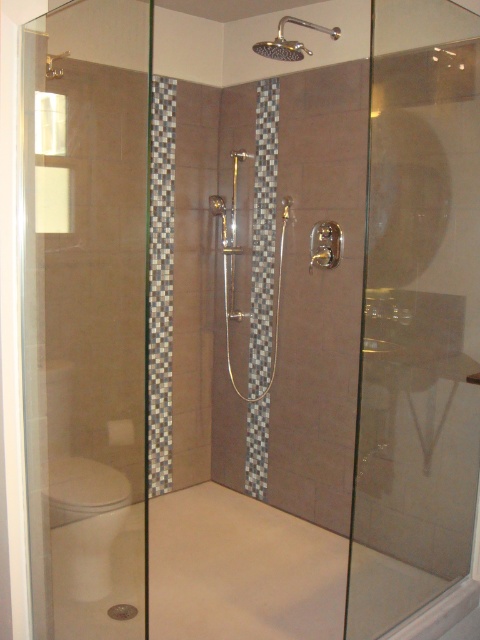
Question: Is transparent glass screen door at left to the right of polished chrome shower head at upper center from the viewer's perspective?

Choices:
 (A) yes
 (B) no

Answer: (B)

Question: Estimate the real-world distances between objects in this image. Which object is farther from the transparent glass screen door at right?

Choices:
 (A) polished chrome shower head at upper center
 (B) transparent glass screen door at left
 (C) white glossy toilet bowl at lower left

Answer: (C)

Question: Is white glossy toilet bowl at lower left thinner than polished chrome shower head at upper center?

Choices:
 (A) yes
 (B) no

Answer: (B)

Question: Which object is closer to the camera taking this photo?

Choices:
 (A) transparent glass screen door at left
 (B) white glossy toilet bowl at lower left
 (C) transparent glass screen door at right

Answer: (A)

Question: Does transparent glass screen door at left have a smaller size compared to polished chrome shower head at upper center?

Choices:
 (A) yes
 (B) no

Answer: (B)

Question: Which point is farther to the camera?

Choices:
 (A) (108, 554)
 (B) (319, 29)

Answer: (A)